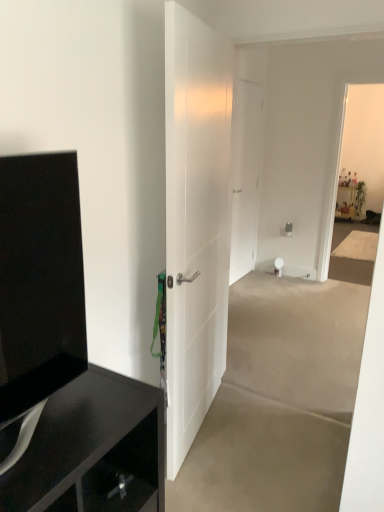
Question: Is white smooth door at center, the first door positioned from the front, shorter than black glossy tv cabinet at left?

Choices:
 (A) yes
 (B) no

Answer: (B)

Question: Could black glossy tv cabinet at left be considered to be inside white smooth door at center, the first door in the left-to-right sequence?

Choices:
 (A) no
 (B) yes

Answer: (A)

Question: Can you confirm if white smooth door at center, which is the 2th door in back-to-front order, is taller than black glossy tv cabinet at left?

Choices:
 (A) yes
 (B) no

Answer: (A)

Question: Can you confirm if white smooth door at center, which is the 2th door in back-to-front order, is bigger than black glossy tv cabinet at left?

Choices:
 (A) yes
 (B) no

Answer: (A)

Question: Is white smooth door at center, arranged as the second door when viewed from the right, outside black glossy tv cabinet at left?

Choices:
 (A) no
 (B) yes

Answer: (B)

Question: From a real-world perspective, is white smooth door at center, arranged as the second door when viewed from the right, located beneath black glossy tv cabinet at left?

Choices:
 (A) yes
 (B) no

Answer: (A)

Question: Can you confirm if black glossy cabinet at left is positioned to the right of white matte door at center, the first door when ordered from right to left?

Choices:
 (A) yes
 (B) no

Answer: (B)

Question: Is black glossy cabinet at left placed right next to white matte door at center, the first door when ordered from right to left?

Choices:
 (A) no
 (B) yes

Answer: (A)

Question: Does black glossy cabinet at left appear on the left side of white matte door at center, which is the first door from back to front?

Choices:
 (A) no
 (B) yes

Answer: (B)

Question: Would you say white matte door at center, which is the first door from back to front, is part of black glossy cabinet at left's contents?

Choices:
 (A) no
 (B) yes

Answer: (A)

Question: Does black glossy cabinet at left have a lesser width compared to white matte door at center, which is counted as the 2th door, starting from the front?

Choices:
 (A) no
 (B) yes

Answer: (A)

Question: Is black glossy cabinet at left taller than white matte door at center, which is the first door from back to front?

Choices:
 (A) yes
 (B) no

Answer: (B)

Question: Are white matte door at center, which is the first door from back to front, and white smooth door at center, arranged as the second door when viewed from the right, beside each other?

Choices:
 (A) yes
 (B) no

Answer: (B)